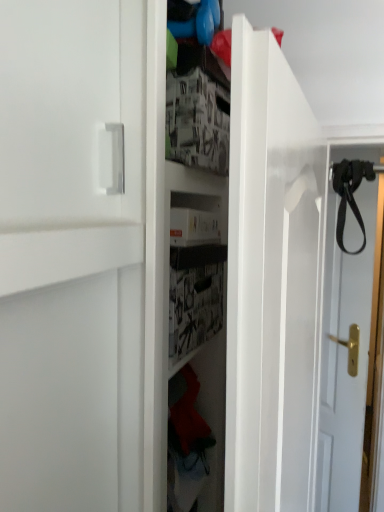
Question: In the image, is black leather strap at upper right positioned in front of or behind black leather strap at right?

Choices:
 (A) front
 (B) behind

Answer: (A)

Question: Is black leather strap at upper right wider or thinner than black leather strap at right?

Choices:
 (A) thin
 (B) wide

Answer: (A)

Question: Is black leather strap at upper right situated inside black leather strap at right or outside?

Choices:
 (A) outside
 (B) inside

Answer: (A)

Question: Is point (364, 145) positioned closer to the camera than point (359, 169)?

Choices:
 (A) farther
 (B) closer

Answer: (B)

Question: In terms of width, does black leather strap at right look wider or thinner when compared to black leather strap at upper right?

Choices:
 (A) wide
 (B) thin

Answer: (A)

Question: In the image, is black leather strap at right positioned in front of or behind black leather strap at upper right?

Choices:
 (A) behind
 (B) front

Answer: (A)

Question: In the image, is black leather strap at right on the left side or the right side of black leather strap at upper right?

Choices:
 (A) right
 (B) left

Answer: (A)